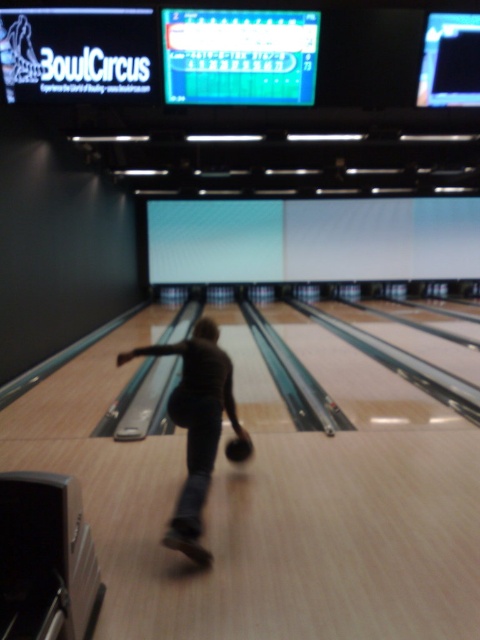
Can you confirm if dark brown leather bowling ball at center is bigger than black matte bowling ball at center?

Answer: Indeed, dark brown leather bowling ball at center has a larger size compared to black matte bowling ball at center.

Between dark brown leather bowling ball at center and black matte bowling ball at center, which one appears on the right side from the viewer's perspective?

Positioned to the right is black matte bowling ball at center.

Find the location of a particular element. dark brown leather bowling ball at center is located at coordinates (195, 426).